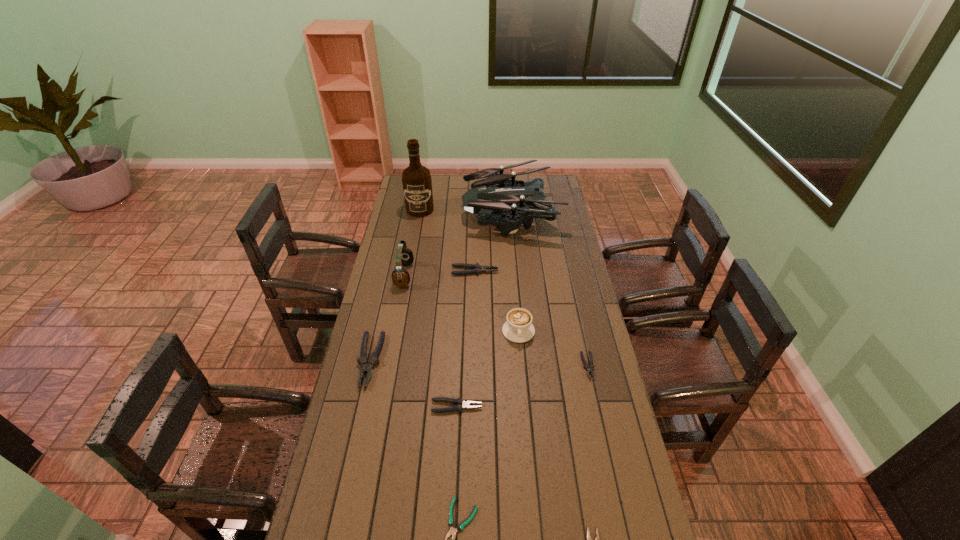
The width and height of the screenshot is (960, 540). Find the location of `the third nearest object`. the third nearest object is located at coordinates (460, 404).

The width and height of the screenshot is (960, 540). What are the coordinates of `the rightmost pliers` in the screenshot? It's located at (589, 368).

Identify the location of the fourth tallest pliers. Image resolution: width=960 pixels, height=540 pixels. (589, 368).

What are the coordinates of `vacant space located 0.180m on the label of the alcohol` in the screenshot? It's located at (415, 238).

Where is `vacant area situated on the front of the drone`? The width and height of the screenshot is (960, 540). vacant area situated on the front of the drone is located at coordinates (515, 252).

Where is `free space located on the ear cups of the eighth shortest object`? The width and height of the screenshot is (960, 540). free space located on the ear cups of the eighth shortest object is located at coordinates (424, 275).

You are a GUI agent. You are given a task and a screenshot of the screen. Output one action in this format:
    pyautogui.click(x=<x>, y=<y>)
    Task: Click on the vacant region located 0.370m to the right of the cappuccino's handle
    This screenshot has width=960, height=540.
    Given the screenshot: What is the action you would take?
    pyautogui.click(x=527, y=436)

At what (x,y) coordinates should I click in order to perform the action: click on vacant area situated 0.290m at the gripping part of the leftmost gray pliers. Please return your answer as a coordinate pair (x, y). This screenshot has width=960, height=540. Looking at the image, I should click on (344, 474).

Identify the location of vacant space situated at the gripping part of the fifth shortest pliers. This screenshot has width=960, height=540. (580, 271).

At what (x,y) coordinates should I click in order to perform the action: click on vacant region located 0.180m at the gripping part of the seventh tallest object. Please return your answer as a coordinate pair (x, y). Image resolution: width=960 pixels, height=540 pixels. Looking at the image, I should click on (536, 407).